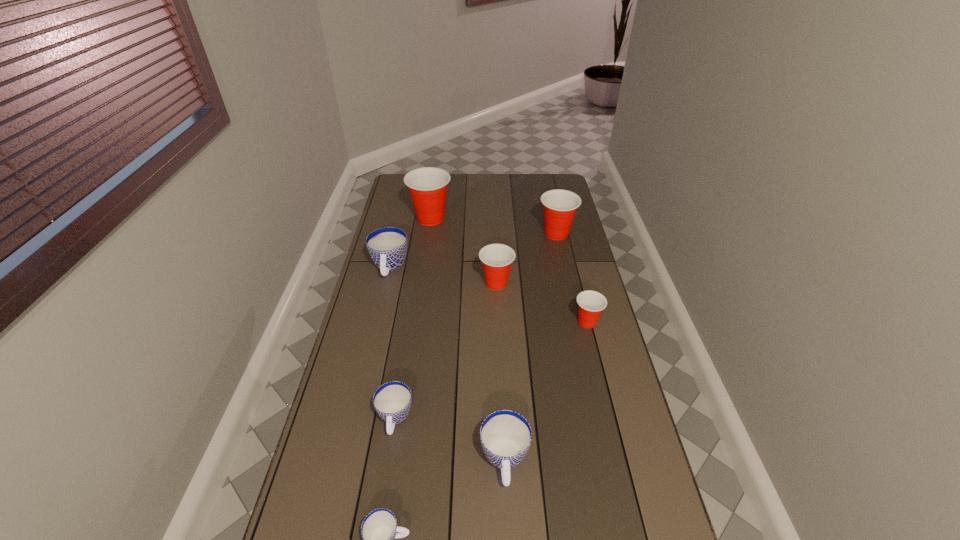
Identify the location of the third biggest blue cup. The width and height of the screenshot is (960, 540). (392, 401).

Find the location of `the seventh tallest cup`. the seventh tallest cup is located at coordinates (392, 401).

This screenshot has height=540, width=960. I want to click on vacant space located 0.240m on the right of the biggest red cup, so click(x=503, y=219).

The height and width of the screenshot is (540, 960). I want to click on blank space located on the left of the second tallest object, so click(495, 234).

Locate an element on the screen. This screenshot has height=540, width=960. free space located 0.220m on the back of the second smallest red cup is located at coordinates (494, 240).

The width and height of the screenshot is (960, 540). What are the coordinates of `vacant space situated 0.070m on the side of the biggest blue cup with the handle` in the screenshot? It's located at (382, 298).

This screenshot has width=960, height=540. In order to click on free space located on the side of the rightmost blue cup with the handle in this screenshot , I will do `click(508, 537)`.

Locate an element on the screen. The width and height of the screenshot is (960, 540). vacant space located on the front of the fifth farthest cup is located at coordinates (594, 350).

Where is `vacant region located 0.170m on the side of the seventh tallest cup with the handle`? This screenshot has height=540, width=960. vacant region located 0.170m on the side of the seventh tallest cup with the handle is located at coordinates (381, 505).

Where is `vacant position at the far edge of the desktop`? The width and height of the screenshot is (960, 540). vacant position at the far edge of the desktop is located at coordinates (494, 191).